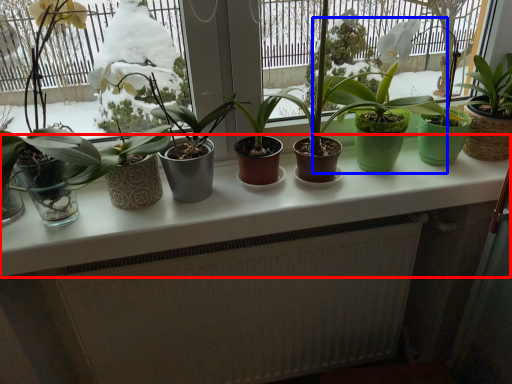
Question: Which object appears farthest to the camera in this image, counter top (highlighted by a red box) or houseplant (highlighted by a blue box)?

Choices:
 (A) counter top
 (B) houseplant

Answer: (B)